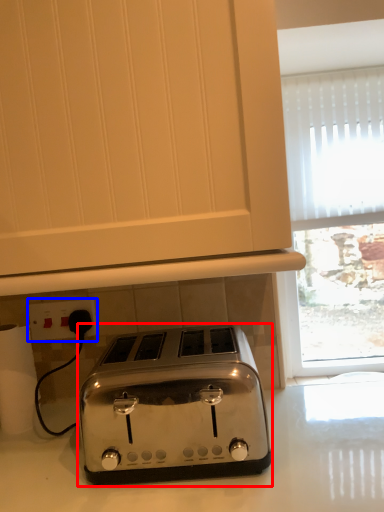
Question: Among these objects, which one is farthest to the camera, toaster (highlighted by a red box) or electric outlet (highlighted by a blue box)?

Choices:
 (A) toaster
 (B) electric outlet

Answer: (B)